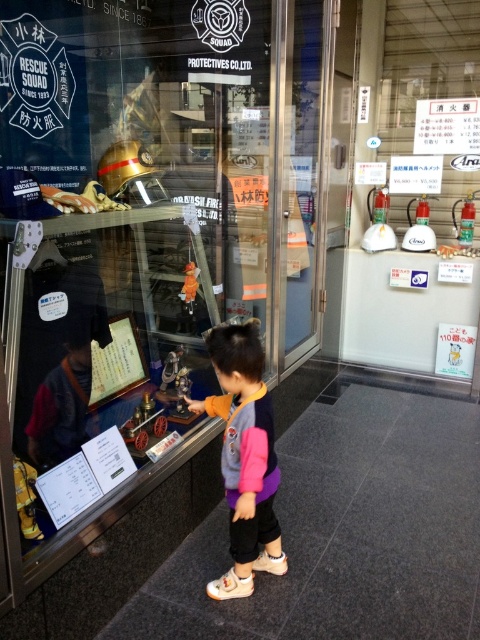
Question: Which point appears closest to the camera in this image?

Choices:
 (A) (108, 346)
 (B) (252, 371)

Answer: (B)

Question: Does multicolored fabric jacket at center appear on the left side of wooden plaque at center?

Choices:
 (A) yes
 (B) no

Answer: (B)

Question: Is multicolored fabric jacket at center positioned at the back of wooden plaque at center?

Choices:
 (A) yes
 (B) no

Answer: (B)

Question: Does multicolored fabric jacket at center lie in front of wooden plaque at center?

Choices:
 (A) no
 (B) yes

Answer: (B)

Question: Among these objects, which one is farthest from the camera?

Choices:
 (A) wooden plaque at center
 (B) multicolored fabric jacket at center

Answer: (A)